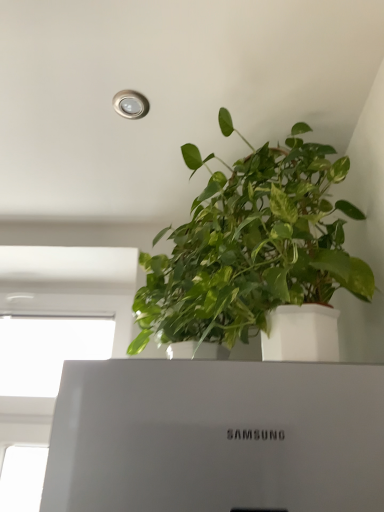
Question: In terms of width, does green matte plant at upper center look wider or thinner when compared to white glossy window at lower left?

Choices:
 (A) wide
 (B) thin

Answer: (A)

Question: Looking at the image, does green matte plant at upper center seem bigger or smaller compared to white glossy window at lower left?

Choices:
 (A) small
 (B) big

Answer: (B)

Question: Relative to white glossy window at lower left, is green matte plant at upper center in front or behind?

Choices:
 (A) behind
 (B) front

Answer: (A)

Question: In the image, is white glossy window at lower left positioned in front of or behind green matte plant at upper center?

Choices:
 (A) behind
 (B) front

Answer: (B)

Question: Is point (6, 384) closer or farther from the camera than point (198, 222)?

Choices:
 (A) farther
 (B) closer

Answer: (A)

Question: From the image's perspective, is white glossy window at lower left positioned above or below green matte plant at upper center?

Choices:
 (A) below
 (B) above

Answer: (A)

Question: From a real-world perspective, is white glossy window at lower left above or below green matte plant at upper center?

Choices:
 (A) above
 (B) below

Answer: (B)